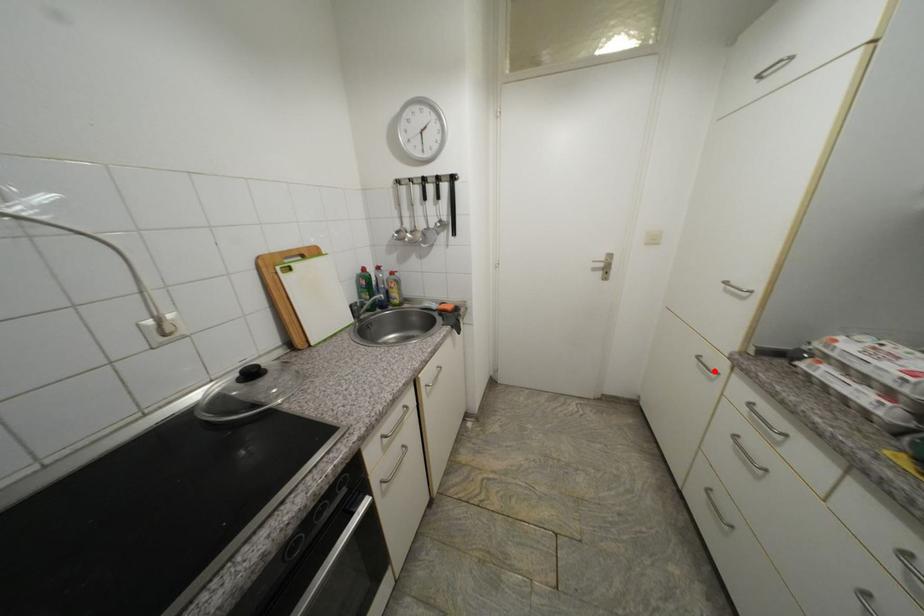
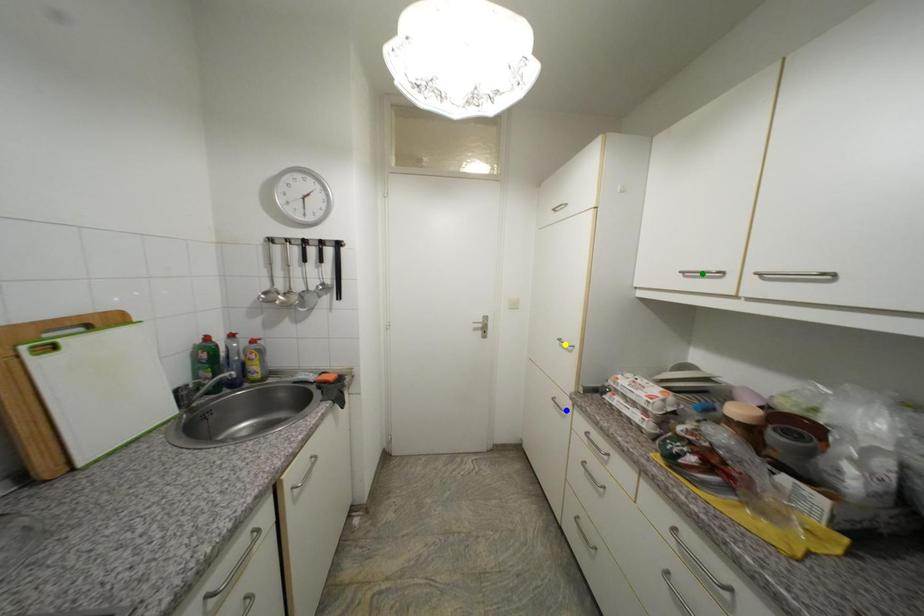
Question: I am providing you with two images of the same scene from different viewpoints. A red point is marked on the first image. You are given multiple points on the second image. Which mark in image 2 goes with the point in image 1?

Choices:
 (A) green point
 (B) blue point
 (C) yellow point

Answer: (B)